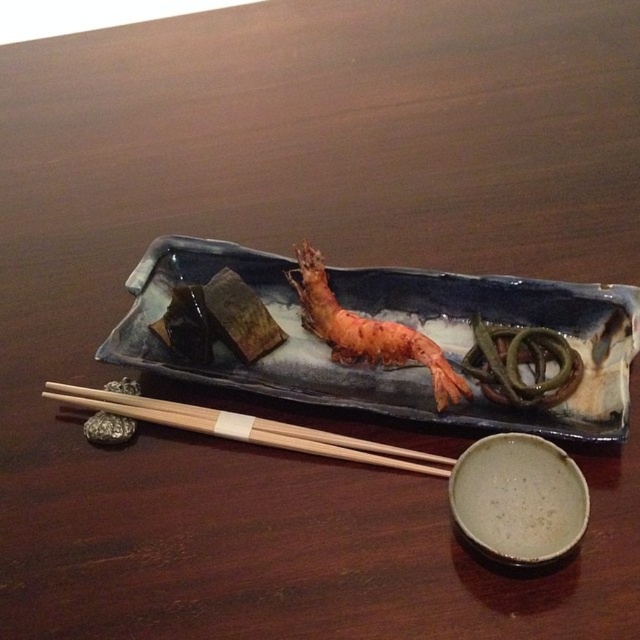
You are a person with a 20 cm long hand. You want to pick up the shiny orange shrimp at center using the wooden chopsticks at lower left. Can you reach the shrimp without moving your hand?

The wooden chopsticks at lower left is 21.83 centimeters away from the shiny orange shrimp at center. Since your hand is 20 cm long, you cannot reach the shrimp without moving your hand.